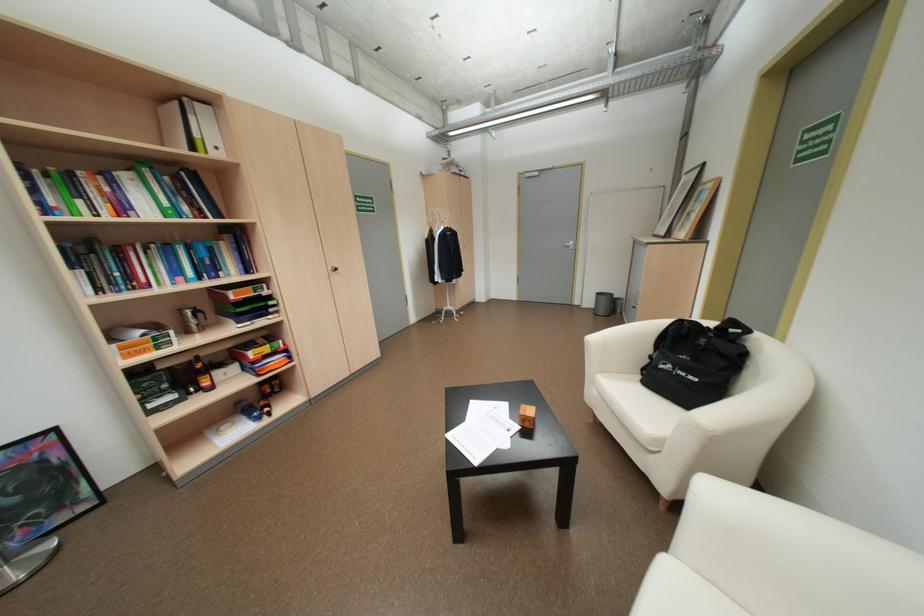
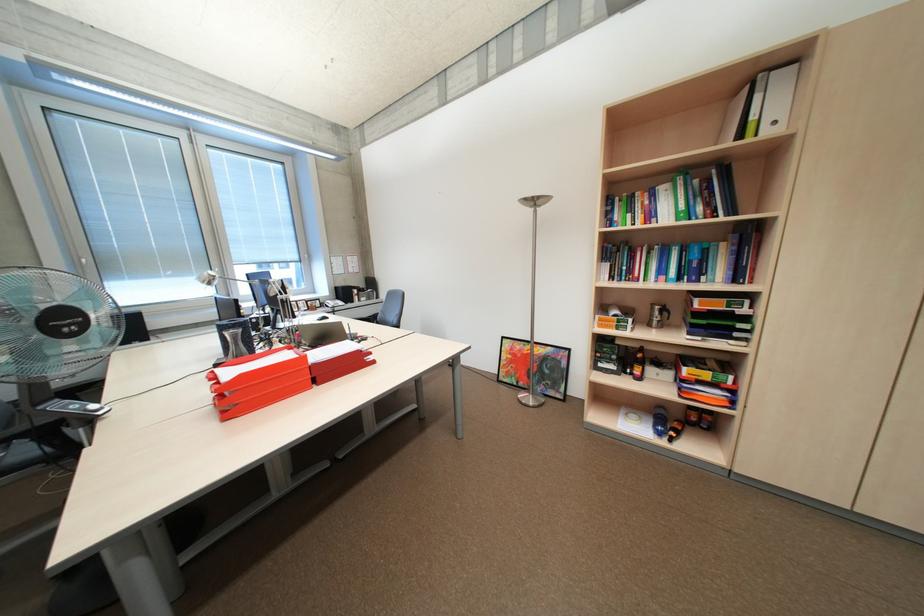
In the second image, find the point that corresponds to [190,310] in the first image.

(663, 304)